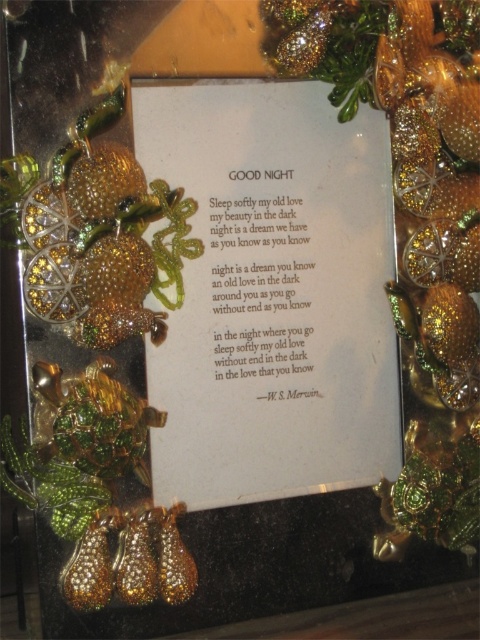
Question: Which object is positioned farthest from the shiny gold ornament at left?

Choices:
 (A) gold glitter ornament at center
 (B) white paper at center

Answer: (A)

Question: From the image, what is the correct spatial relationship of white paper at center in relation to gold glitter ornament at center?

Choices:
 (A) left
 (B) right

Answer: (A)

Question: From the image, what is the correct spatial relationship of white paper at center in relation to gold glitter ornament at center?

Choices:
 (A) right
 (B) left

Answer: (B)

Question: Which of the following is the farthest from the observer?

Choices:
 (A) white paper at center
 (B) shiny gold ornament at left
 (C) gold glitter ornament at center

Answer: (A)

Question: Considering the relative positions of white paper at center and shiny gold ornament at left in the image provided, where is white paper at center located with respect to shiny gold ornament at left?

Choices:
 (A) left
 (B) right

Answer: (B)

Question: Which object is closer to the camera taking this photo?

Choices:
 (A) white paper at center
 (B) shiny gold ornament at left

Answer: (B)